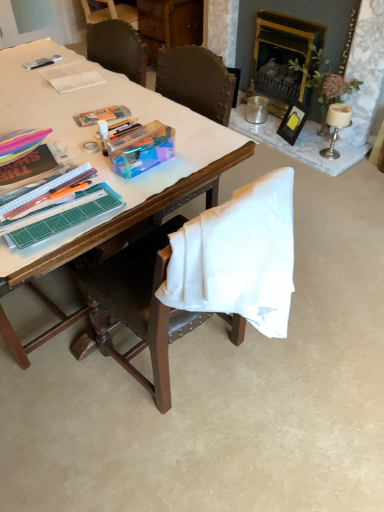
Question: Choose the correct answer: Is wooden desk at center inside gold-framed fireplace at upper right or outside it?

Choices:
 (A) inside
 (B) outside

Answer: (B)

Question: In terms of width, does wooden desk at center look wider or thinner when compared to gold-framed fireplace at upper right?

Choices:
 (A) wide
 (B) thin

Answer: (A)

Question: Which object is the closest to the gold-framed fireplace at upper right?

Choices:
 (A) wooden chair at center
 (B) black wood picture frame at upper right
 (C) white paper at upper left
 (D) metallic silver pen at upper left
 (E) wooden desk at center

Answer: (B)

Question: Based on their relative distances, which object is farther from the white paper at upper left?

Choices:
 (A) metallic silver pen at upper left
 (B) gold-framed fireplace at upper right
 (C) wooden desk at center
 (D) black wood picture frame at upper right
 (E) wooden chair at center

Answer: (B)